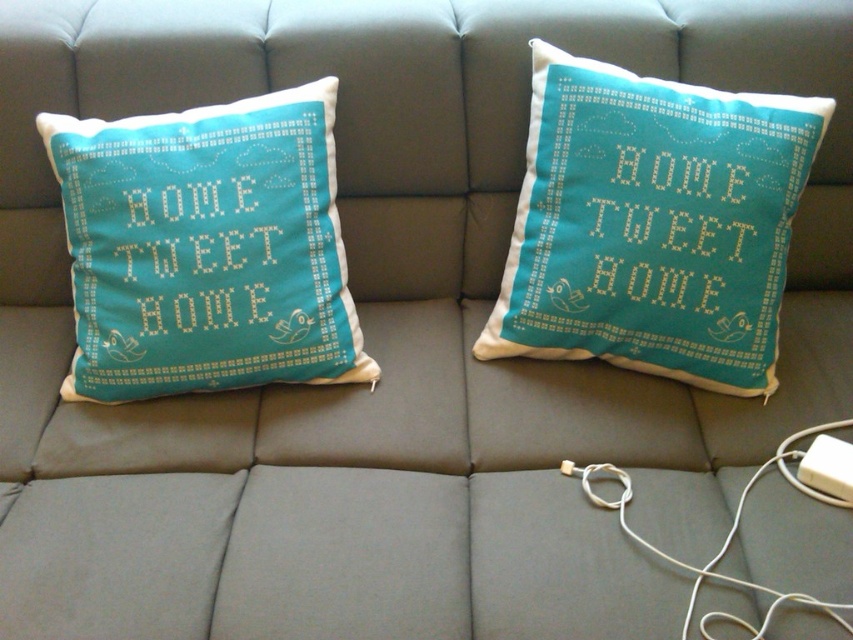
Is teal cross-stitch pillow at left wider than white plastic charger at lower right?

Correct, the width of teal cross-stitch pillow at left exceeds that of white plastic charger at lower right.

Between point (358, 352) and point (711, 577), which one is positioned behind?

Positioned behind is point (358, 352).

Measure the distance between point (55, 144) and camera.

The distance of point (55, 144) from camera is 1.32 meters.

Identify the location of teal cross-stitch pillow at left. (206, 248).

Which is more to the right, teal cross-stitch pillow at upper right or teal cross-stitch pillow at left?

teal cross-stitch pillow at upper right is more to the right.

Who is taller, teal cross-stitch pillow at upper right or teal cross-stitch pillow at left?

Standing taller between the two is teal cross-stitch pillow at upper right.

Is point (544, 269) positioned behind point (111, 248)?

Yes, point (544, 269) is behind point (111, 248).

This screenshot has height=640, width=853. In order to click on teal cross-stitch pillow at upper right in this screenshot , I will do `click(653, 225)`.

This screenshot has width=853, height=640. What do you see at coordinates (653, 225) in the screenshot?
I see `teal cross-stitch pillow at upper right` at bounding box center [653, 225].

Between point (759, 385) and point (688, 624), which one is positioned in front?

Point (688, 624)

You are a GUI agent. You are given a task and a screenshot of the screen. Output one action in this format:
    pyautogui.click(x=<x>, y=<y>)
    Task: Click on the teal cross-stitch pillow at upper right
    The width and height of the screenshot is (853, 640).
    Given the screenshot: What is the action you would take?
    pyautogui.click(x=653, y=225)